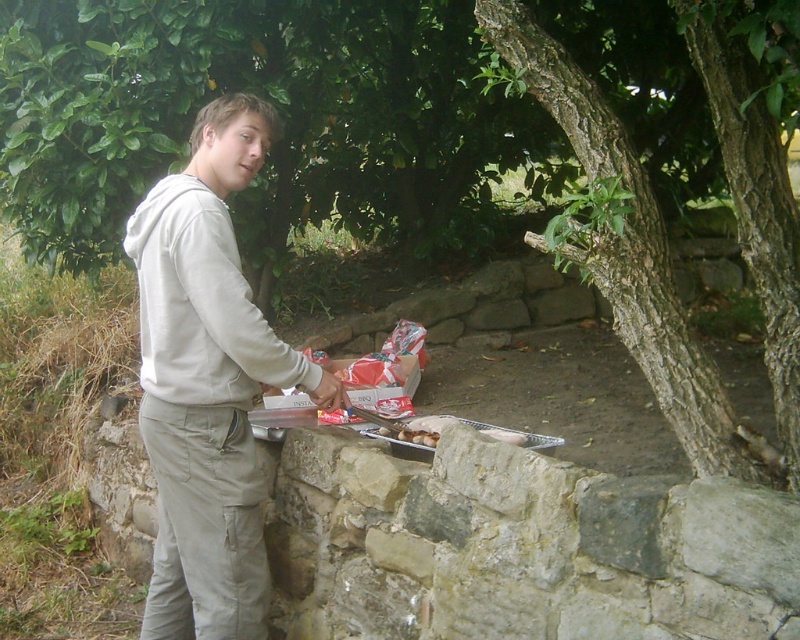
Who is positioned more to the right, brown rough bark tree at center or white fleece sweatshirt at center?

Positioned to the right is brown rough bark tree at center.

Does brown rough bark tree at center come behind white fleece sweatshirt at center?

No, brown rough bark tree at center is in front of white fleece sweatshirt at center.

Who is more forward, (536, 70) or (248, 291)?

Point (536, 70) is in front.

The image size is (800, 640). I want to click on brown rough bark tree at center, so 624,243.

The width and height of the screenshot is (800, 640). What do you see at coordinates (208, 381) in the screenshot?
I see `light gray hoodie at center` at bounding box center [208, 381].

Measure the distance between light gray hoodie at center and brown rough bark tree at center.

They are 1.00 meters apart.

Locate an element on the screen. This screenshot has width=800, height=640. light gray hoodie at center is located at coordinates (208, 381).

The image size is (800, 640). What are the coordinates of `light gray hoodie at center` in the screenshot? It's located at (208, 381).

Which is below, light gray hoodie at center or white fleece sweatshirt at center?

Positioned lower is light gray hoodie at center.

Which is in front, point (266, 355) or point (293, 376)?

Point (266, 355)

You are a GUI agent. You are given a task and a screenshot of the screen. Output one action in this format:
    pyautogui.click(x=<x>, y=<y>)
    Task: Click on the light gray hoodie at center
    Image resolution: width=800 pixels, height=640 pixels.
    Given the screenshot: What is the action you would take?
    pyautogui.click(x=208, y=381)